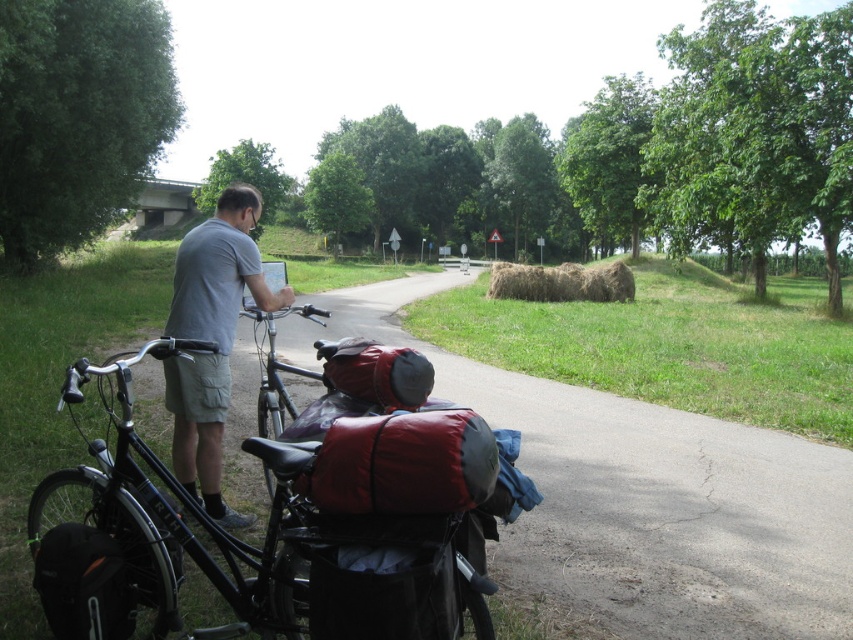
Which of these two, black matte bicycle at left or gray cotton shirt at left, stands shorter?

With less height is gray cotton shirt at left.

Who is more forward, (160, 355) or (202, 250)?

Point (160, 355)

The image size is (853, 640). What are the coordinates of `black matte bicycle at left` in the screenshot? It's located at (271, 529).

Between point (194, 353) and point (550, 296), which one is positioned in front?

Point (194, 353)

Can you confirm if gray cotton shirt at left is positioned below brown straw bale at center?

Indeed, gray cotton shirt at left is positioned under brown straw bale at center.

At what (x,y) coordinates should I click in order to perform the action: click on gray cotton shirt at left. Please return your answer as a coordinate pair (x, y). The height and width of the screenshot is (640, 853). Looking at the image, I should click on (212, 339).

Looking at this image, who is taller, black matte bicycle at left or brown straw bale at center?

brown straw bale at center is taller.

Describe the element at coordinates (271, 529) in the screenshot. I see `black matte bicycle at left` at that location.

I want to click on black matte bicycle at left, so click(271, 529).